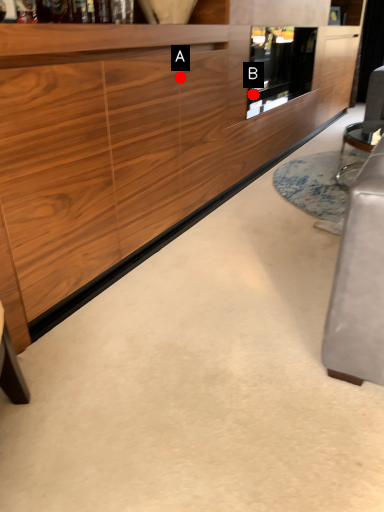
Question: Two points are circled on the image, labeled by A and B beside each circle. Which of the following is the farthest from the observer?

Choices:
 (A) A is further
 (B) B is further

Answer: (B)